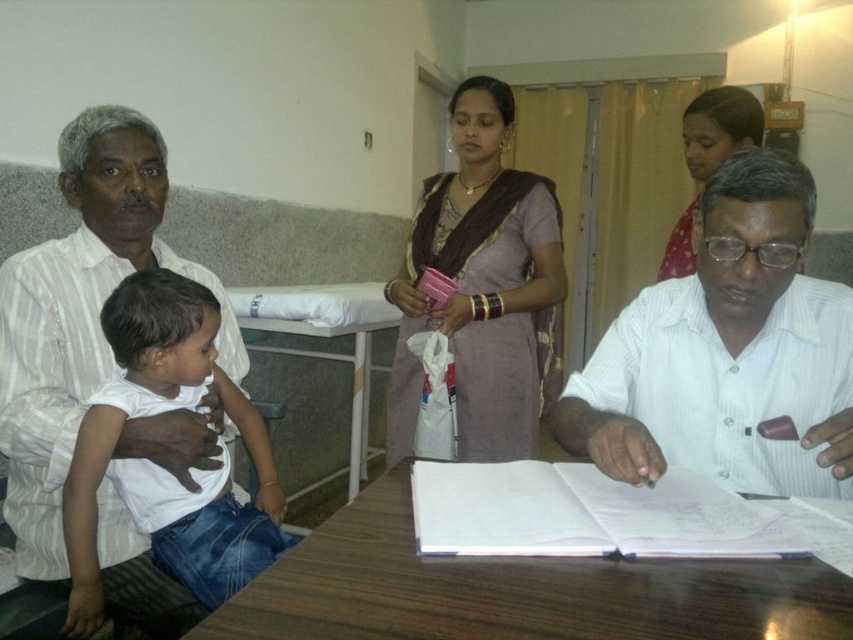
You are a security guard in the office. You need to locate the white striped shirt at left. Where is it positioned in the image?

The white striped shirt at left is positioned at point 0.494 on the x axis and 0.095 on the y axis.

Based on the coordinates provided, which object in the scene is located at point (323, 352)?

The white plastic table at center is located at point (323, 352).